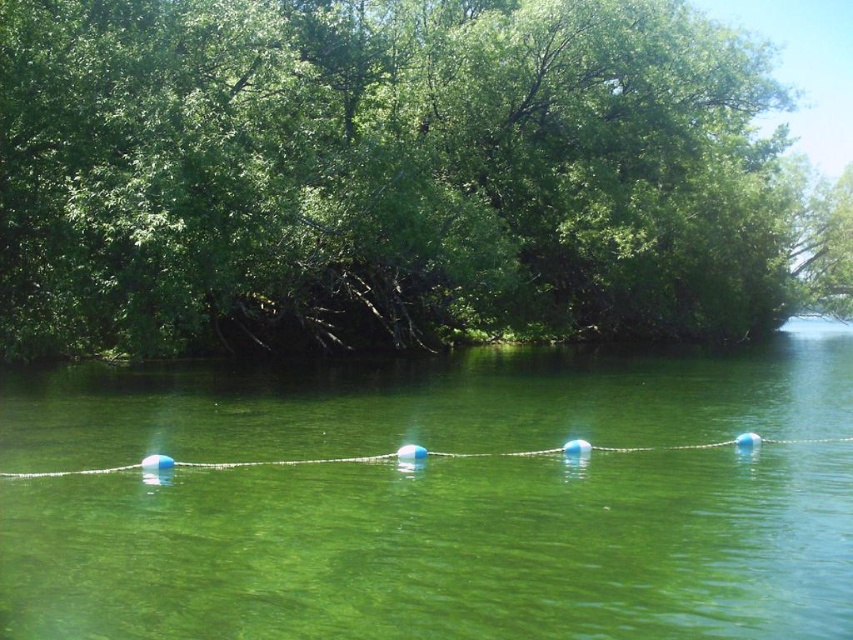
Between green leafy tree at center and blue rubber buoy at center, which one appears on the right side from the viewer's perspective?

Positioned to the right is green leafy tree at center.

Between point (79, 0) and point (532, 621), which one is positioned behind?

Point (79, 0)

Is point (281, 193) positioned in front of point (403, 497)?

No, it is not.

Locate an element on the screen. Image resolution: width=853 pixels, height=640 pixels. green leafy tree at center is located at coordinates tap(396, 177).